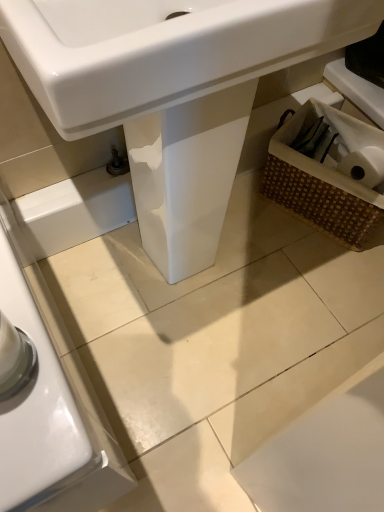
The width and height of the screenshot is (384, 512). Identify the location of blank area beneath white glossy sink at center (from a real-world perspective). (187, 273).